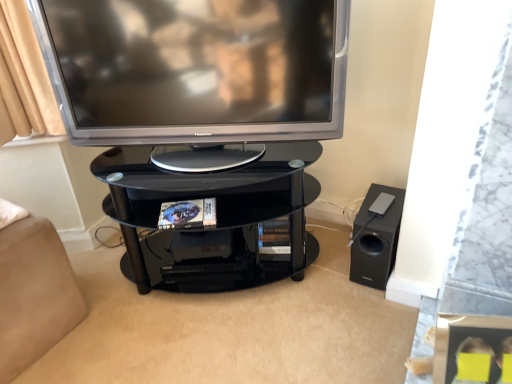
This screenshot has width=512, height=384. What do you see at coordinates (216, 219) in the screenshot? I see `black glass shelf at center` at bounding box center [216, 219].

This screenshot has width=512, height=384. Describe the element at coordinates (33, 290) in the screenshot. I see `beige fabric bed at lower left` at that location.

At what (x,y) coordinates should I click in order to perform the action: click on satin silver television at upper center. Please return your answer as a coordinate pair (x, y). The image size is (512, 384). Looking at the image, I should click on (196, 73).

In the image, there is a beige fabric bed at lower left. Where is `speaker below it (from a real-world perspective)`? This screenshot has width=512, height=384. speaker below it (from a real-world perspective) is located at coordinates (376, 236).

From the picture: Considering the relative sizes of beige fabric bed at lower left and black matte speaker at lower right in the image provided, is beige fabric bed at lower left smaller than black matte speaker at lower right?

Actually, beige fabric bed at lower left might be larger than black matte speaker at lower right.

Is beige fabric bed at lower left beside black matte speaker at lower right?

There is a gap between beige fabric bed at lower left and black matte speaker at lower right.

Is beige fabric bed at lower left inside or outside of black matte speaker at lower right?

beige fabric bed at lower left is spatially situated outside black matte speaker at lower right.

Is satin silver television at upper center oriented towards beige fabric bed at lower left?

No, satin silver television at upper center is not facing towards beige fabric bed at lower left.

Considering the positions of objects satin silver television at upper center and beige fabric bed at lower left in the image provided, who is more to the left, satin silver television at upper center or beige fabric bed at lower left?

Positioned to the left is beige fabric bed at lower left.

Is black matte speaker at lower right completely or partially outside of satin silver television at upper center?

That's correct, black matte speaker at lower right is outside of satin silver television at upper center.

Is black matte speaker at lower right thinner than satin silver television at upper center?

No, black matte speaker at lower right is not thinner than satin silver television at upper center.

Is black matte speaker at lower right positioned with its back to satin silver television at upper center?

No, black matte speaker at lower right is not facing away from satin silver television at upper center.

Who is more distant, black matte speaker at lower right or satin silver television at upper center?

black matte speaker at lower right is further from the camera.

Between black glass shelf at center and beige fabric bed at lower left, which one has larger width?

With larger width is black glass shelf at center.

From the image's perspective, is black glass shelf at center located above or below beige fabric bed at lower left?

Clearly, from the image's perspective, black glass shelf at center is above beige fabric bed at lower left.

Would you say black glass shelf at center is a long distance from beige fabric bed at lower left?

They are positioned close to each other.

How many degrees apart are the facing directions of black glass shelf at center and beige fabric bed at lower left?

There is a 57.5-degree angle between the facing directions of black glass shelf at center and beige fabric bed at lower left.

From the image's perspective, which one is positioned lower, satin silver television at upper center or black matte speaker at lower right?

From the image's view, black matte speaker at lower right is below.

Is satin silver television at upper center positioned beyond the bounds of black matte speaker at lower right?

Indeed, satin silver television at upper center is completely outside black matte speaker at lower right.

Is satin silver television at upper center in contact with black matte speaker at lower right?

No, satin silver television at upper center is not next to black matte speaker at lower right.

Would you say satin silver television at upper center is to the left or to the right of black matte speaker at lower right in the picture?

satin silver television at upper center is positioned on black matte speaker at lower right's left side.

Considering the relative positions of black matte speaker at lower right and black glass shelf at center in the image provided, is black matte speaker at lower right to the right of black glass shelf at center from the viewer's perspective?

Indeed, black matte speaker at lower right is positioned on the right side of black glass shelf at center.

You are a GUI agent. You are given a task and a screenshot of the screen. Output one action in this format:
    pyautogui.click(x=<x>, y=<y>)
    Task: Click on the speaker below the black glass shelf at center (from the image's perspective)
    
    Given the screenshot: What is the action you would take?
    point(376,236)

Which of these two, black matte speaker at lower right or black glass shelf at center, is thinner?

black matte speaker at lower right is thinner.

Can you confirm if black matte speaker at lower right is shorter than black glass shelf at center?

Correct, black matte speaker at lower right is not as tall as black glass shelf at center.

Which is behind, beige fabric bed at lower left or black glass shelf at center?

black glass shelf at center is further away from the camera.

Is beige fabric bed at lower left looking in the opposite direction of black glass shelf at center?

beige fabric bed at lower left is not turned away from black glass shelf at center.

The width and height of the screenshot is (512, 384). Find the location of `furniture located below the black glass shelf at center (from the image's perspective)`. furniture located below the black glass shelf at center (from the image's perspective) is located at coordinates (33, 290).

Is beige fabric bed at lower left far from black glass shelf at center?

No, there isn't a large distance between beige fabric bed at lower left and black glass shelf at center.

Where is `furniture that is on the left side of black matte speaker at lower right`? The image size is (512, 384). furniture that is on the left side of black matte speaker at lower right is located at coordinates (33, 290).

At what (x,y) coordinates should I click in order to perform the action: click on television that is on the right side of beige fabric bed at lower left. Please return your answer as a coordinate pair (x, y). Image resolution: width=512 pixels, height=384 pixels. Looking at the image, I should click on (196, 73).

Considering their positions, is black matte speaker at lower right positioned further to satin silver television at upper center than black glass shelf at center?

black matte speaker at lower right lies further to satin silver television at upper center than the other object.

Which object lies further to the anchor point black glass shelf at center, beige fabric bed at lower left or black matte speaker at lower right?

Among the two, black matte speaker at lower right is located further to black glass shelf at center.

From the image, which object appears to be farther from black matte speaker at lower right, black glass shelf at center or satin silver television at upper center?

satin silver television at upper center lies further to black matte speaker at lower right than the other object.

From the image, which object appears to be farther from black glass shelf at center, beige fabric bed at lower left or satin silver television at upper center?

beige fabric bed at lower left.

Based on their spatial positions, is black glass shelf at center or black matte speaker at lower right further from satin silver television at upper center?

The object further to satin silver television at upper center is black matte speaker at lower right.

Based on the photo, based on their spatial positions, is beige fabric bed at lower left or black glass shelf at center further from black matte speaker at lower right?

Based on the image, beige fabric bed at lower left appears to be further to black matte speaker at lower right.

When comparing their distances from satin silver television at upper center, does beige fabric bed at lower left or black glass shelf at center seem closer?

Among the two, black glass shelf at center is located nearer to satin silver television at upper center.

Estimate the real-world distances between objects in this image. Which object is closer to beige fabric bed at lower left, black glass shelf at center or black matte speaker at lower right?

black glass shelf at center.

This screenshot has width=512, height=384. I want to click on shelf between beige fabric bed at lower left and black matte speaker at lower right in the horizontal direction, so click(x=216, y=219).

Where is `television between beige fabric bed at lower left and black matte speaker at lower right in the horizontal direction`? The image size is (512, 384). television between beige fabric bed at lower left and black matte speaker at lower right in the horizontal direction is located at coordinates (196, 73).

The image size is (512, 384). Identify the location of television between beige fabric bed at lower left and black glass shelf at center. (196, 73).

Identify the location of shelf situated between satin silver television at upper center and black matte speaker at lower right from left to right. The height and width of the screenshot is (384, 512). (216, 219).